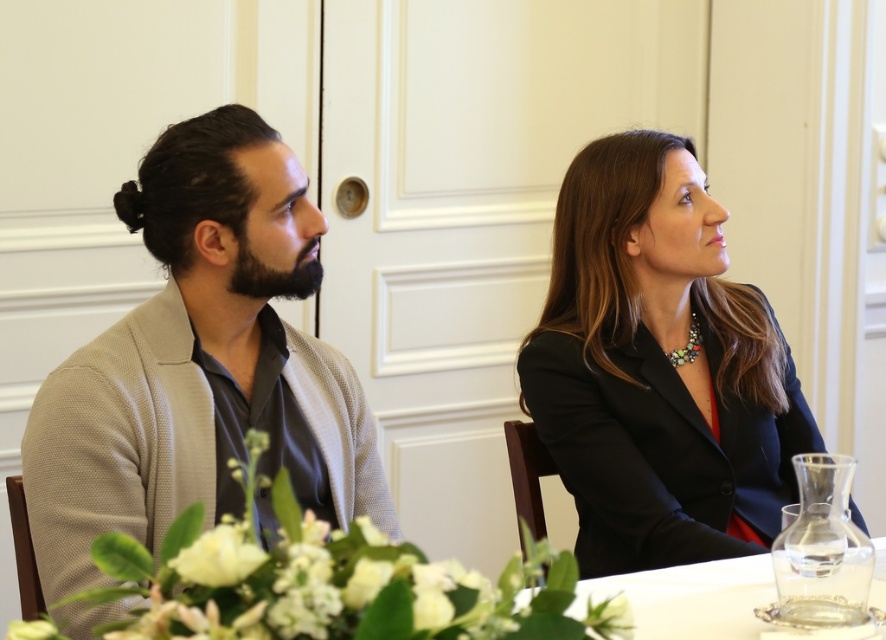
Question: Which point appears farthest from the camera in this image?

Choices:
 (A) (149, 346)
 (B) (626, 356)
 (C) (767, 556)

Answer: (B)

Question: Is matte black blazer at center bigger than clear glass water at lower center?

Choices:
 (A) yes
 (B) no

Answer: (A)

Question: Which point is closer to the camera?

Choices:
 (A) beige textured cardigan at left
 (B) clear glass water at lower center

Answer: (B)

Question: Does beige textured cardigan at left appear under matte black blazer at center?

Choices:
 (A) no
 (B) yes

Answer: (B)

Question: Which of the following is the farthest from the observer?

Choices:
 (A) clear glass water at lower center
 (B) matte black blazer at center

Answer: (B)

Question: Is beige textured cardigan at left behind matte black blazer at center?

Choices:
 (A) no
 (B) yes

Answer: (A)